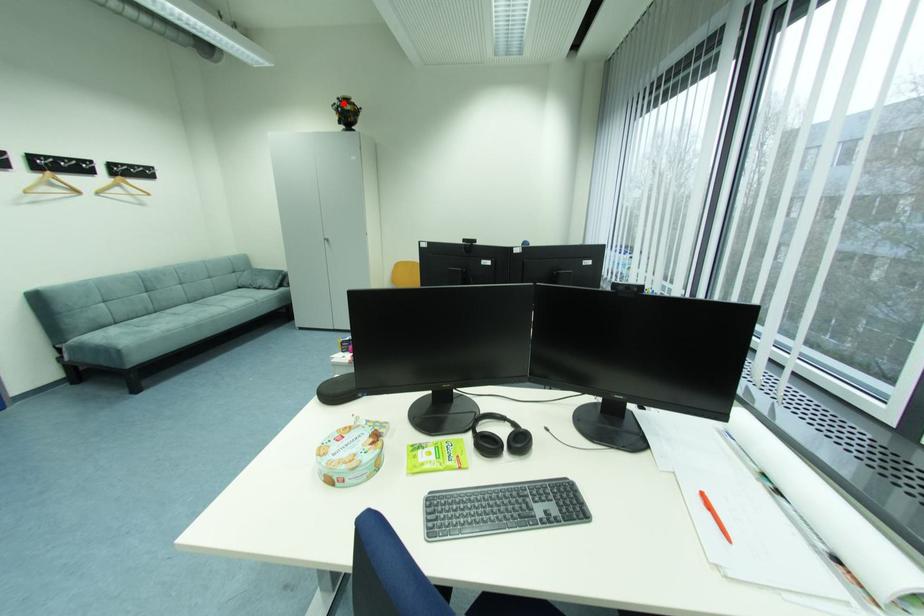
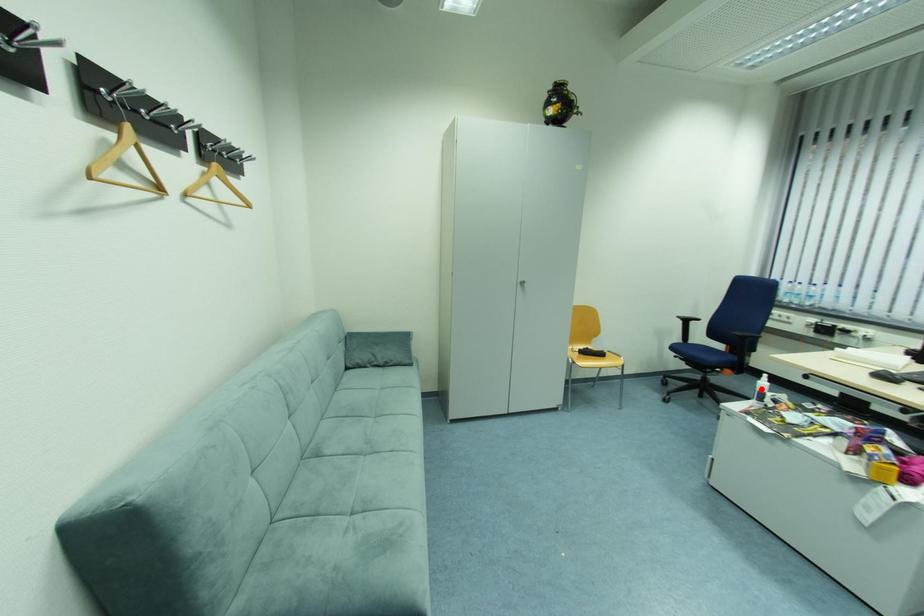
I am providing you with two images of the same scene from different viewpoints. A red point is marked on the first image and another point is marked on the second image. Is the marked point in image1 the same physical position as the marked point in image2?

No